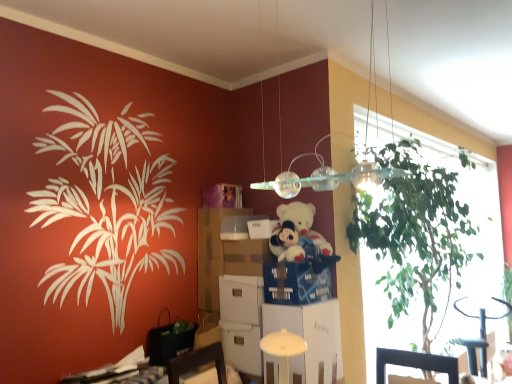
This screenshot has width=512, height=384. What do you see at coordinates (310, 339) in the screenshot?
I see `white cardboard box at center` at bounding box center [310, 339].

You are a GUI agent. You are given a task and a screenshot of the screen. Output one action in this format:
    pyautogui.click(x=<x>, y=<y>)
    Task: Click on the cardboard drawer at center, the 1th drawer viewed from the left
    Image resolution: width=512 pixels, height=384 pixels.
    Given the screenshot: What is the action you would take?
    pyautogui.click(x=245, y=256)

Describe the element at coordinates (261, 228) in the screenshot. Image resolution: width=512 pixels, height=384 pixels. I see `white cardboard box at center, which is the 1th box from bottom to top` at that location.

How much space does blue cardboard drawer at center, marked as the first drawer in a right-to-left arrangement, occupy horizontally?

The width of blue cardboard drawer at center, marked as the first drawer in a right-to-left arrangement, is 13.33 inches.

Describe the element at coordinates (237, 226) in the screenshot. I see `white cardboard box at upper center, the 2th box positioned from the bottom` at that location.

Measure the distance between point (371,201) and camera.

7.64 feet.

In order to click on white cardboard box at center in this screenshot , I will do `click(310, 339)`.

Is blue cardboard drawer at center, marked as the first drawer in a right-to-left arrangement, touching green leafy plant at upper right?

They are not placed beside each other.

From the image's perspective, between blue cardboard drawer at center, which appears as the 2th drawer when viewed from the left, and green leafy plant at upper right, who is located below?

blue cardboard drawer at center, which appears as the 2th drawer when viewed from the left, appears lower in the image.

Locate an element on the screen. the 1st drawer behind when counting from the green leafy plant at upper right is located at coordinates (297, 284).

Which is correct: blue cardboard drawer at center, which appears as the 2th drawer when viewed from the left, is inside green leafy plant at upper right, or outside of it?

blue cardboard drawer at center, which appears as the 2th drawer when viewed from the left, exists outside the volume of green leafy plant at upper right.

From a real-world perspective, which is physically above, white cardboard box at upper center, the second box from the top, or purple cardboard box at center, the first box from the top?

In real-world perspective, purple cardboard box at center, the first box from the top, is above.

The width and height of the screenshot is (512, 384). I want to click on box that is the 1st one when counting downward from the purple cardboard box at center, the first box from the top (from the image's perspective), so click(x=237, y=226).

Is purple cardboard box at center, the third box when ordered from bottom to top, completely or partially inside white cardboard box at upper center, the 2th box positioned from the bottom?

No, purple cardboard box at center, the third box when ordered from bottom to top, is not inside white cardboard box at upper center, the 2th box positioned from the bottom.

From the image's perspective, between white cardboard box at upper center, the second box from the top, and purple cardboard box at center, the first box from the top, who is located below?

white cardboard box at upper center, the second box from the top, appears lower in the image.

Is green leafy plant at upper right looking in the opposite direction of cardboard drawer at center, the 1th drawer viewed from the left?

No, green leafy plant at upper right is not facing away from cardboard drawer at center, the 1th drawer viewed from the left.

Which is less distant, [406,232] or [254,257]?

Point [406,232]

Looking at this image, who is shorter, green leafy plant at upper right or cardboard drawer at center, the second drawer positioned from the right?

cardboard drawer at center, the second drawer positioned from the right, is shorter.

Starting from the green leafy plant at upper right, which drawer is the 2nd one to the left? Please provide its 2D coordinates.

[(245, 256)]

Is white glossy round table at lower center closer to camera compared to purple cardboard box at center, the first box from the top?

No, the depth of white glossy round table at lower center is greater than that of purple cardboard box at center, the first box from the top.

From a real-world perspective, which is physically below, white glossy round table at lower center or purple cardboard box at center, the third box when ordered from bottom to top?

white glossy round table at lower center.

In the scene shown: Is white glossy round table at lower center positioned far away from purple cardboard box at center, the third box when ordered from bottom to top?

white glossy round table at lower center is positioned a significant distance from purple cardboard box at center, the third box when ordered from bottom to top.

Based on the photo, how distant is white cardboard box at center from blue cardboard drawer at center, marked as the first drawer in a right-to-left arrangement?

The distance of white cardboard box at center from blue cardboard drawer at center, marked as the first drawer in a right-to-left arrangement, is 16.24 centimeters.

From the image's perspective, which one is positioned lower, white cardboard box at center or blue cardboard drawer at center, marked as the first drawer in a right-to-left arrangement?

From the image's view, white cardboard box at center is below.

In the scene shown: Considering the sizes of objects white cardboard box at center and blue cardboard drawer at center, marked as the first drawer in a right-to-left arrangement, in the image provided, who is taller, white cardboard box at center or blue cardboard drawer at center, marked as the first drawer in a right-to-left arrangement,?

white cardboard box at center.

Is white cardboard box at center completely or partially outside of blue cardboard drawer at center, which appears as the 2th drawer when viewed from the left?

Yes, white cardboard box at center is located beyond the bounds of blue cardboard drawer at center, which appears as the 2th drawer when viewed from the left.

From the image's perspective, is white cardboard box at center under white glossy round table at lower center?

Incorrect, from the image's perspective, white cardboard box at center is higher than white glossy round table at lower center.

Is point (277, 329) positioned in front of point (500, 301)?

Yes.

Considering the sizes of objects white cardboard box at center and white glossy round table at lower center in the image provided, who is wider, white cardboard box at center or white glossy round table at lower center?

white glossy round table at lower center.

Is white cardboard box at center closer to the viewer compared to white glossy round table at lower center?

Yes, white cardboard box at center is in front of white glossy round table at lower center.

How many degrees apart are the facing directions of cardboard drawer at center, the 1th drawer viewed from the left, and purple cardboard box at center, the third box when ordered from bottom to top?

cardboard drawer at center, the 1th drawer viewed from the left, and purple cardboard box at center, the third box when ordered from bottom to top, are facing 2.94 degrees away from each other.

How far apart are cardboard drawer at center, the 1th drawer viewed from the left, and purple cardboard box at center, the third box when ordered from bottom to top?

They are 13.54 inches apart.

The width and height of the screenshot is (512, 384). Identify the location of drawer that is the 1st one when counting forward from the purple cardboard box at center, the third box when ordered from bottom to top. (245, 256).

Which of these two, cardboard drawer at center, the second drawer positioned from the right, or purple cardboard box at center, the first box from the top, stands taller?

cardboard drawer at center, the second drawer positioned from the right.

Locate an element on the screen. This screenshot has height=384, width=512. drawer that is the 1st object located behind the green leafy plant at upper right is located at coordinates (297, 284).

Which box is the 1st one when counting from the right side of the purple cardboard box at center, the first box from the top? Please provide its 2D coordinates.

[(237, 226)]

From the image, which object appears to be farther from white plush teddy bear at center, white glossy round table at lower center or white cardboard box at center?

The object further to white plush teddy bear at center is white glossy round table at lower center.

Consider the image. Considering their positions, is white glossy round table at lower center positioned closer to white cardboard box at center, which is the 1th box from bottom to top, than blue cardboard drawer at center, marked as the first drawer in a right-to-left arrangement?

blue cardboard drawer at center, marked as the first drawer in a right-to-left arrangement, lies closer to white cardboard box at center, which is the 1th box from bottom to top, than the other object.

Consider the image. Considering their positions, is white glossy round table at lower center positioned closer to white plush teddy bear at center than blue cardboard drawer at center, marked as the first drawer in a right-to-left arrangement?

Based on the image, blue cardboard drawer at center, marked as the first drawer in a right-to-left arrangement, appears to be nearer to white plush teddy bear at center.

Based on their spatial positions, is white cardboard box at center or white glossy round table at lower center closer to green leafy plant at upper right?

Among the two, white cardboard box at center is located nearer to green leafy plant at upper right.

Based on their spatial positions, is white cardboard box at center or white cardboard box at center, which is the 1th box from bottom to top, closer to purple cardboard box at center, the third box when ordered from bottom to top?

white cardboard box at center, which is the 1th box from bottom to top, lies closer to purple cardboard box at center, the third box when ordered from bottom to top, than the other object.

Estimate the real-world distances between objects in this image. Which object is further from cardboard drawer at center, the second drawer positioned from the right, blue cardboard drawer at center, marked as the first drawer in a right-to-left arrangement, or white cardboard box at center, positioned as the 3th box in top-to-bottom order?

blue cardboard drawer at center, marked as the first drawer in a right-to-left arrangement, lies further to cardboard drawer at center, the second drawer positioned from the right, than the other object.

Looking at the image, which one is located further to blue cardboard drawer at center, which appears as the 2th drawer when viewed from the left, white cardboard box at center or white cardboard box at center, which is the 1th box from bottom to top?

Among the two, white cardboard box at center, which is the 1th box from bottom to top, is located further to blue cardboard drawer at center, which appears as the 2th drawer when viewed from the left.

Looking at the image, which one is located further to white cardboard box at center, positioned as the 3th box in top-to-bottom order, cardboard drawer at center, the second drawer positioned from the right, or white plush teddy bear at center?

Based on the image, white plush teddy bear at center appears to be further to white cardboard box at center, positioned as the 3th box in top-to-bottom order.

In order to click on teddy between cardboard drawer at center, the 1th drawer viewed from the left, and white glossy round table at lower center, in the horizontal direction in this screenshot , I will do `click(296, 232)`.

At what (x,y) coordinates should I click in order to perform the action: click on houseplant between white cardboard box at upper center, the second box from the top, and white glossy round table at lower center from left to right. Please return your answer as a coordinate pair (x, y). Looking at the image, I should click on (415, 234).

Where is `box between white cardboard box at upper center, the second box from the top, and white plush teddy bear at center, in the horizontal direction`? This screenshot has height=384, width=512. box between white cardboard box at upper center, the second box from the top, and white plush teddy bear at center, in the horizontal direction is located at coordinates (261, 228).

At what (x,y) coordinates should I click in order to perform the action: click on box between cardboard drawer at center, the second drawer positioned from the right, and white glossy round table at lower center from left to right. Please return your answer as a coordinate pair (x, y). This screenshot has height=384, width=512. Looking at the image, I should click on (261, 228).